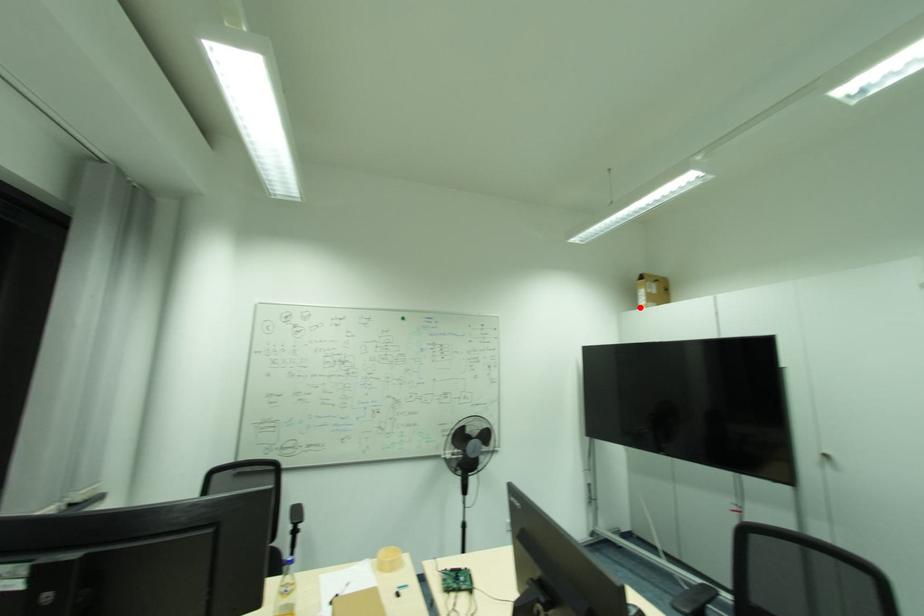
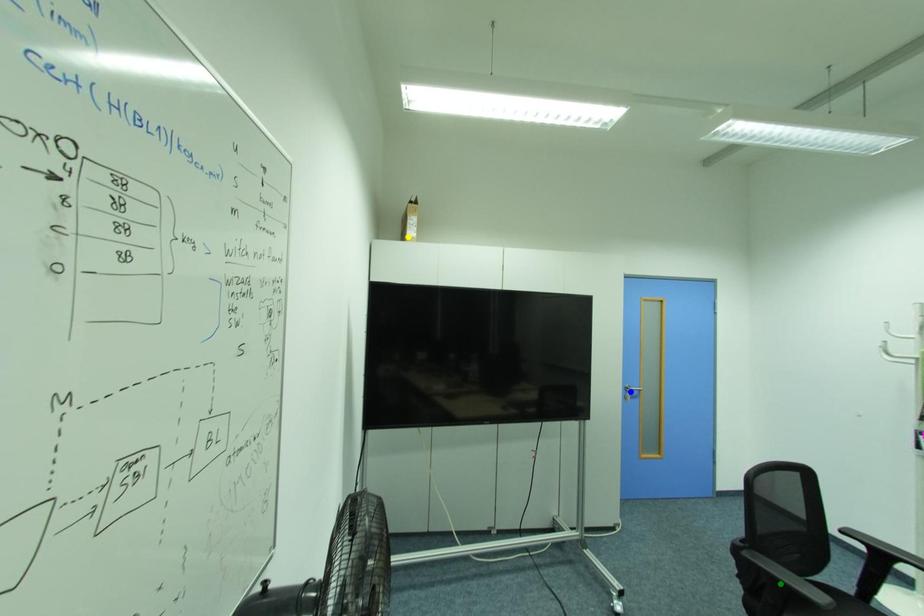
Question: I am providing you with two images of the same scene from different viewpoints. A red point is marked on the first image. You are given multiple points on the second image. Which point in image 2 is actually the same real-world point as the red point in image 1?

Choices:
 (A) green point
 (B) blue point
 (C) yellow point

Answer: (C)